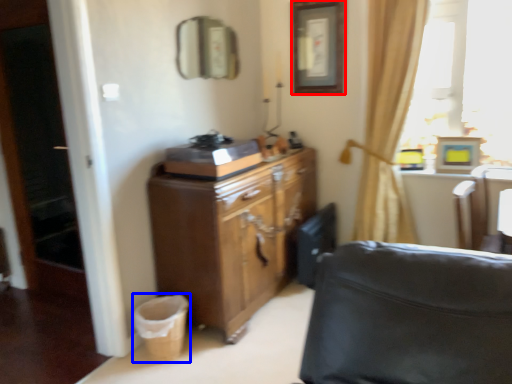
Question: Which point is closer to the camera, picture frame (highlighted by a red box) or laundry basket (highlighted by a blue box)?

Choices:
 (A) picture frame
 (B) laundry basket

Answer: (B)